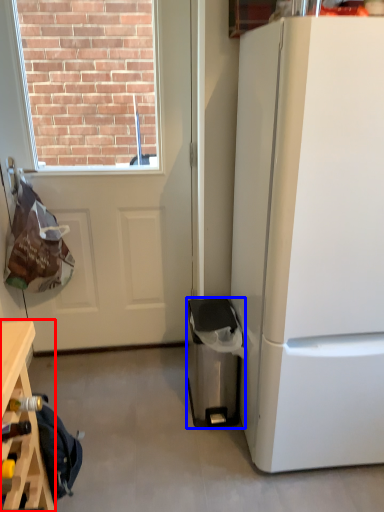
Question: Which of the following is the farthest to the observer, table (highlighted by a red box) or trash bin/can (highlighted by a blue box)?

Choices:
 (A) table
 (B) trash bin/can

Answer: (B)